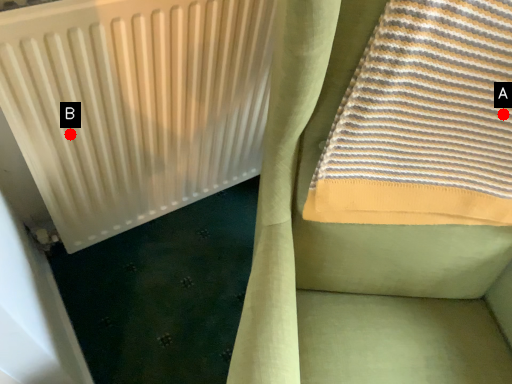
Question: Two points are circled on the image, labeled by A and B beside each circle. Which point is farther to the camera?

Choices:
 (A) A is further
 (B) B is further

Answer: (B)